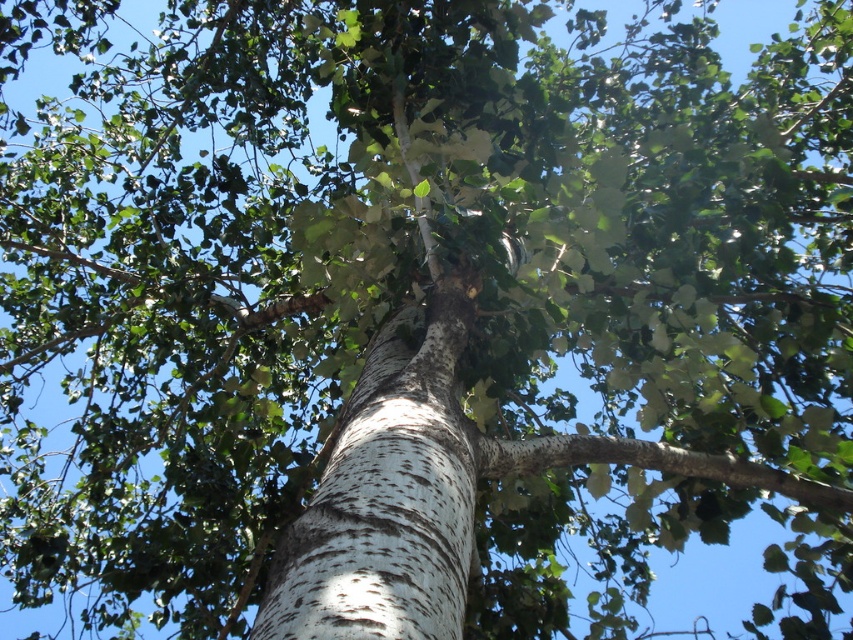
You are an arborist inspecting a tree trunk. You notice a specific point at coordinates point (387, 496). Based on the image, what is the feature located at that point?

The point (387, 496) indicates white speckled bark at center.

Based on the photo, you are a botanist examining the tree trunk. You notice two parts of the tree trunk structure in the image. Which part is taller, the white speckled bark at center or the white rough bark branch at center?

The white speckled bark at center is taller than the white rough bark branch at center according to the description.

You are an arborist examining the tree trunk. You notice two areas of interest on the trunk. The first is the white speckled bark at center, and the second is the white rough bark branch at center. Which of these two areas is located to the left when viewed from the ground?

The white speckled bark at center is positioned on the left side of the white rough bark branch at center, so it is located to the left when viewed from the ground.